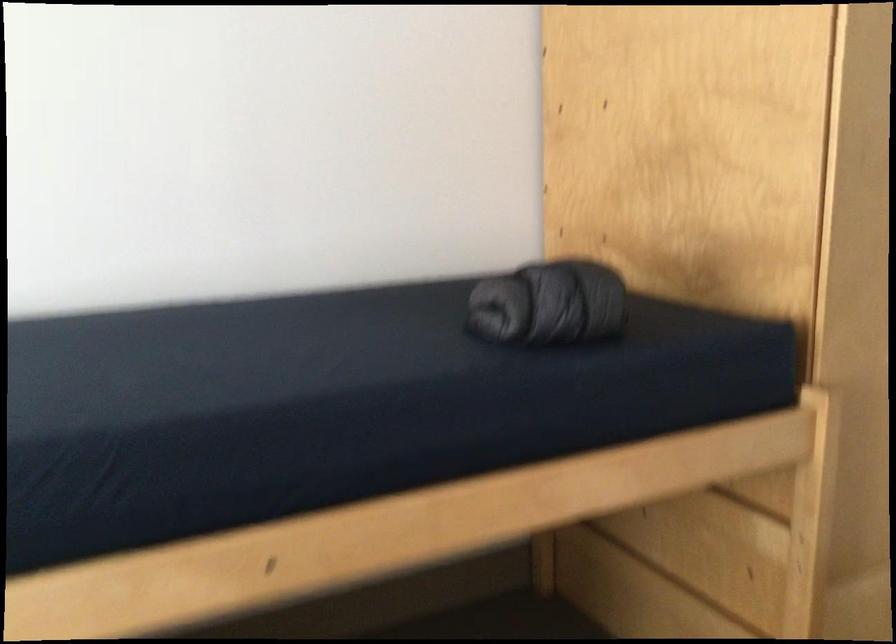
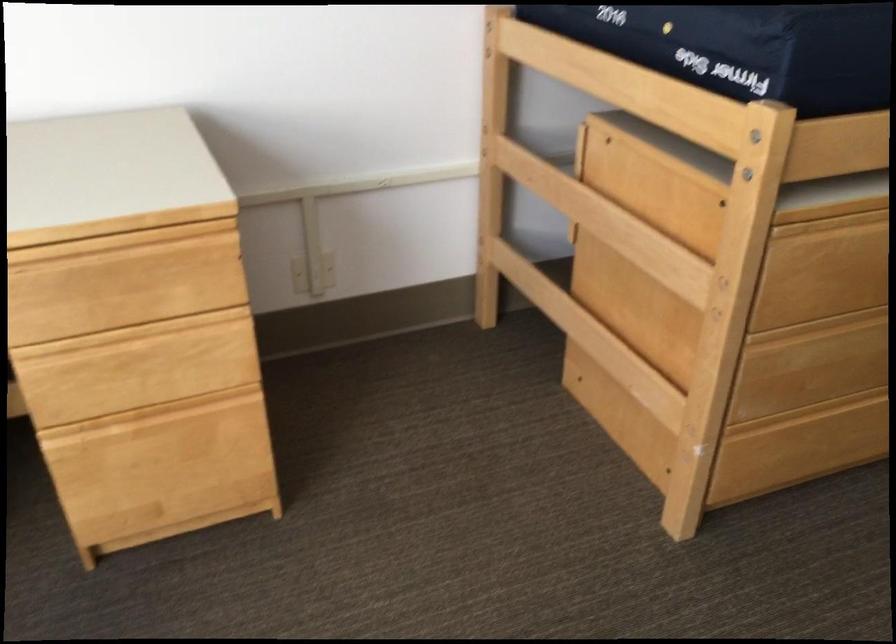
In a continuous first-person perspective shot, in which direction is the camera moving?

The cameraman walked toward left, backward.